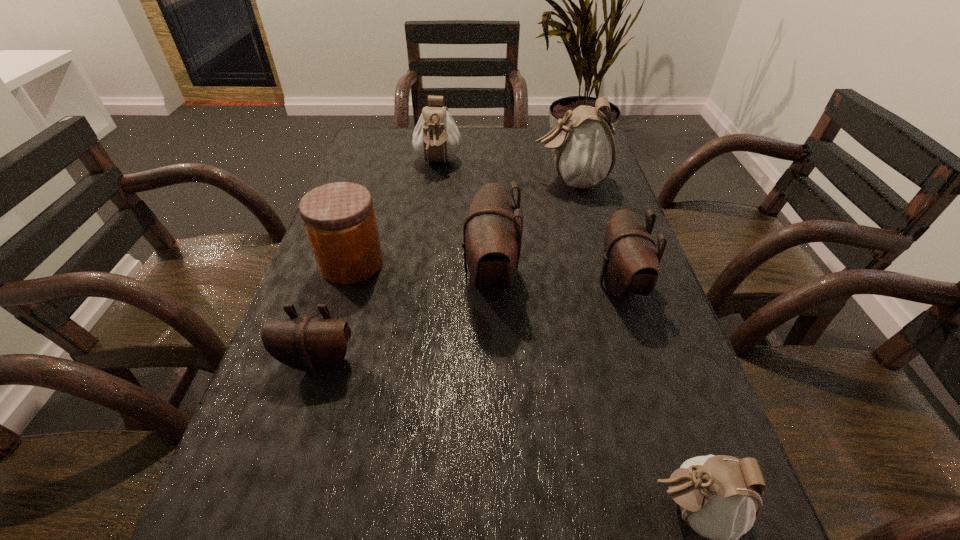
Identify the location of blank area located on the front-facing side of the biggest white pouch. [401, 181].

Where is `free space located 0.310m on the front-facing side of the biggest white pouch`? free space located 0.310m on the front-facing side of the biggest white pouch is located at coordinates (420, 181).

You are a GUI agent. You are given a task and a screenshot of the screen. Output one action in this format:
    pyautogui.click(x=<x>, y=<y>)
    Task: Click on the free spot located 0.320m with the flap open on the second brown pouch from left to right
    The image size is (960, 540).
    Given the screenshot: What is the action you would take?
    pyautogui.click(x=312, y=276)

Locate an element on the screen. The height and width of the screenshot is (540, 960). free point located 0.100m with the flap open on the second brown pouch from left to right is located at coordinates (416, 276).

Locate an element on the screen. free space located with the flap open on the second brown pouch from left to right is located at coordinates (336, 276).

Image resolution: width=960 pixels, height=540 pixels. I want to click on vacant space located on the front-facing side of the fifth pouch from right to left, so click(x=422, y=276).

This screenshot has height=540, width=960. Find the location of `vacant area located on the front of the jar`. vacant area located on the front of the jar is located at coordinates (301, 426).

At what (x,y) coordinates should I click in order to perform the action: click on blank space located 0.210m with the flap open on the second smallest brown pouch. Please return your answer as a coordinate pair (x, y). The image size is (960, 540). Looking at the image, I should click on (496, 285).

What are the coordinates of `vacant point located 0.350m with the flap open on the second smallest brown pouch` in the screenshot? It's located at (429, 285).

This screenshot has width=960, height=540. Identify the location of free space located 0.400m with the flap open on the second smallest brown pouch. (405, 285).